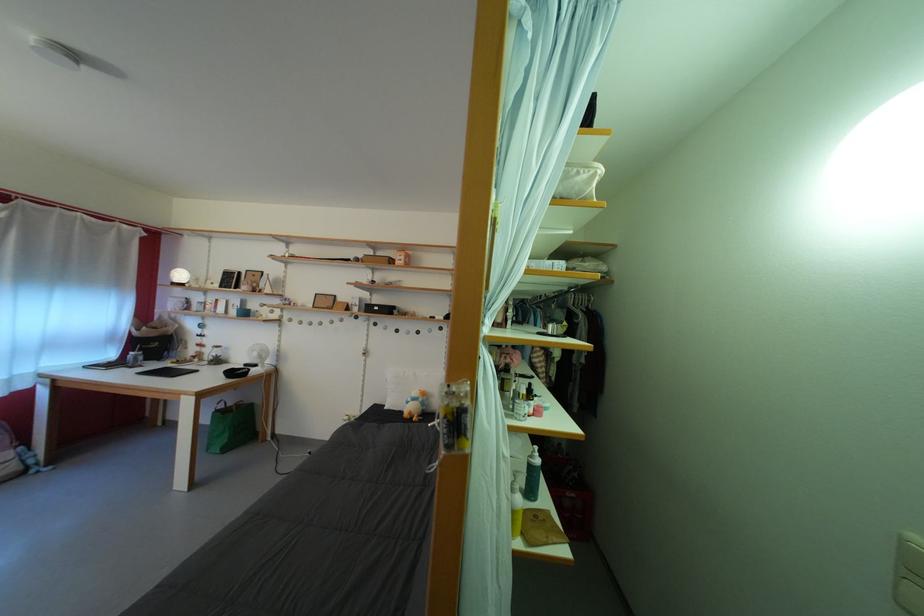
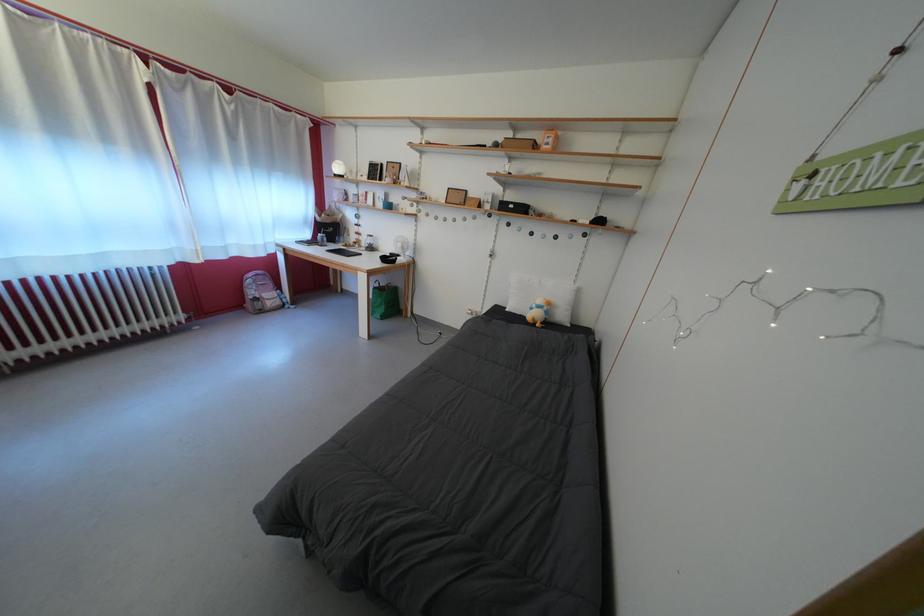
Locate, in the second image, the point that corresponds to point (263, 360) in the first image.

(407, 251)